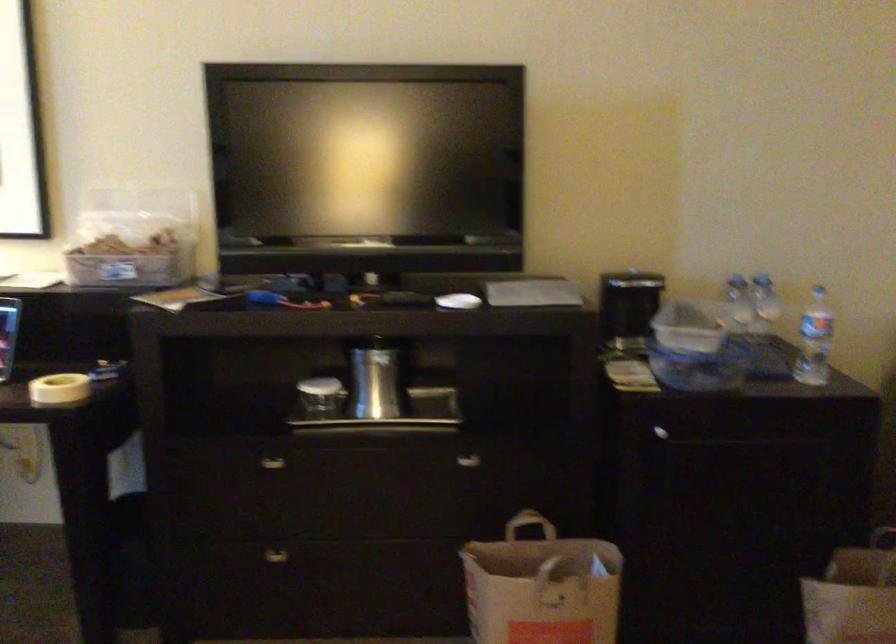
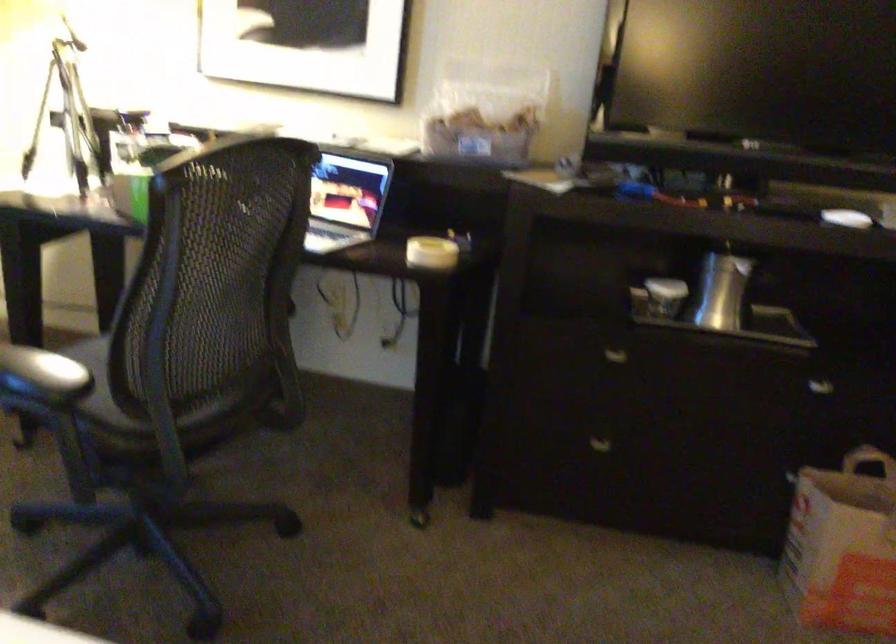
The point at (x=522, y=529) is marked in the first image. Where is the corresponding point in the second image?

(867, 460)